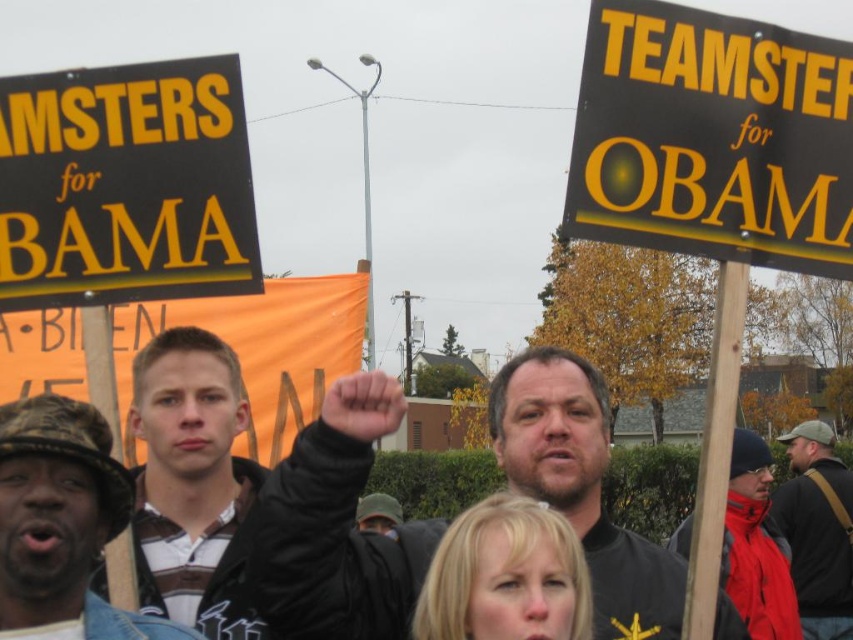
Is black/yellow/black sign at upper right positioned before brown camo hat at left?

No, black/yellow/black sign at upper right is behind brown camo hat at left.

Which is behind, point (729, 74) or point (54, 412)?

Point (54, 412)

Which is in front, point (688, 134) or point (84, 440)?

Positioned in front is point (688, 134).

Locate an element on the screen. black/yellow/black sign at upper right is located at coordinates (712, 138).

Who is taller, black matte jacket at center or brown camo hat at left?

With more height is black matte jacket at center.

Between point (337, 422) and point (120, 632), which one is positioned in front?

Positioned in front is point (120, 632).

Where is `black matte jacket at center`? Image resolution: width=853 pixels, height=640 pixels. black matte jacket at center is located at coordinates (337, 528).

Does black/yellow/black sign at upper right have a greater height compared to black matte jacket at center?

No.

Is black/yellow/black sign at upper right behind black matte jacket at center?

No, black/yellow/black sign at upper right is in front of black matte jacket at center.

This screenshot has width=853, height=640. I want to click on black/yellow/black sign at upper right, so 712,138.

What are the coordinates of `black/yellow/black sign at upper right` in the screenshot? It's located at (712, 138).